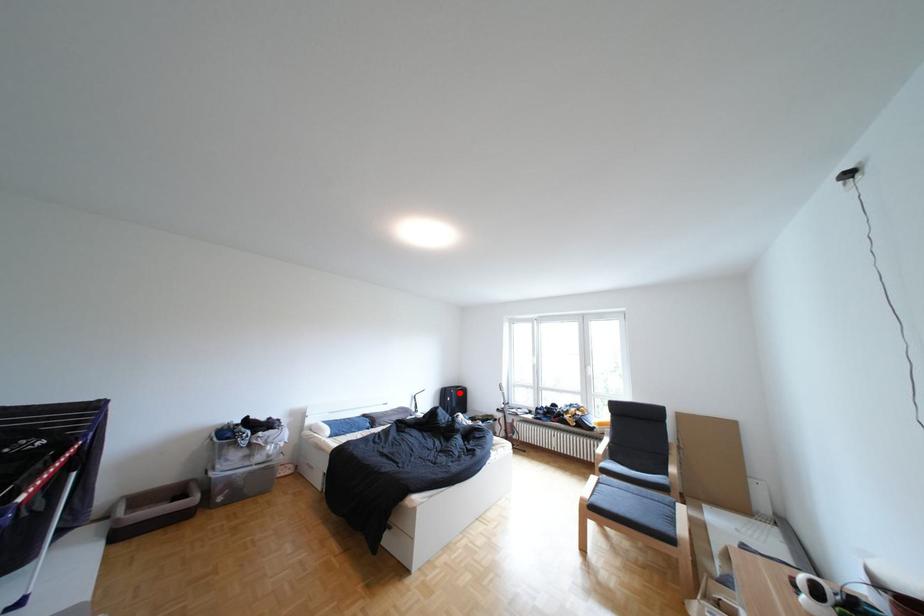
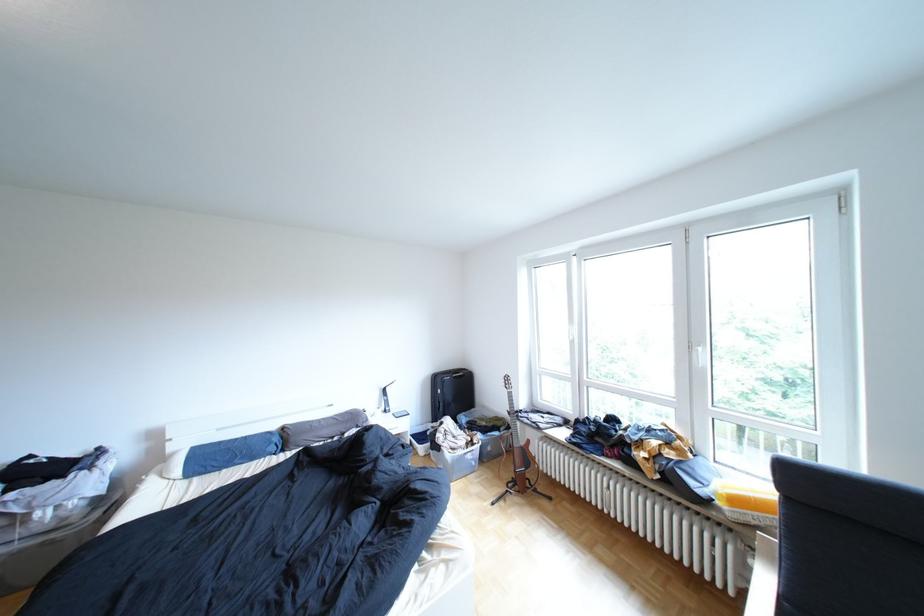
In the second image, find the point that corresponds to the highlighted location in the first image.

(452, 379)